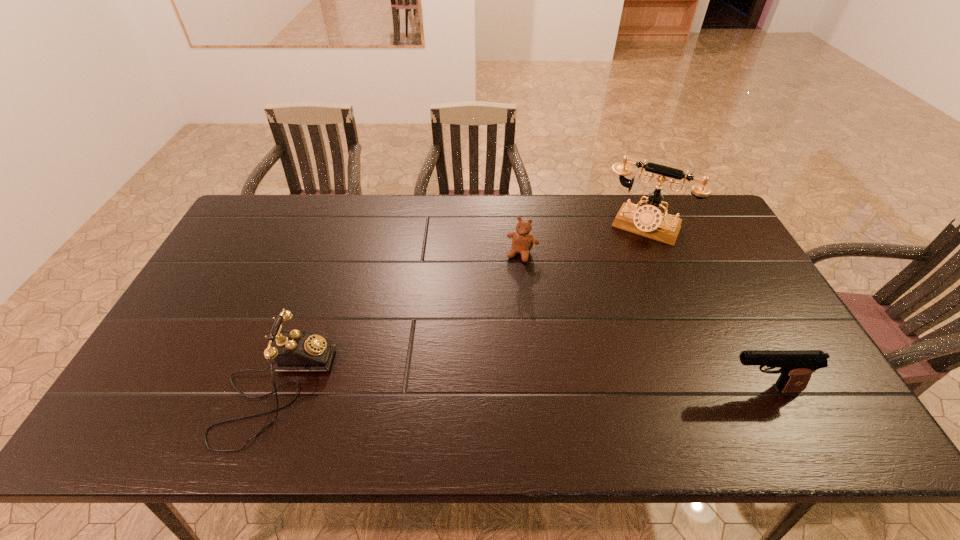
I want to click on unoccupied area between the taller telephone and the left telephone, so 460,308.

Where is `free space between the pistol and the leftmost object`? The height and width of the screenshot is (540, 960). free space between the pistol and the leftmost object is located at coordinates (518, 389).

The image size is (960, 540). Identify the location of free space between the teddy bear and the left telephone. (399, 322).

The height and width of the screenshot is (540, 960). In order to click on blank region between the pistol and the tallest object in this screenshot , I will do click(703, 308).

Find the location of `empty space that is in between the left telephone and the tallest object`. empty space that is in between the left telephone and the tallest object is located at coordinates (460, 308).

Where is `vacant area that lies between the taller telephone and the pistol`? vacant area that lies between the taller telephone and the pistol is located at coordinates click(x=703, y=308).

Where is `object that is the third closest one to the pistol`? The height and width of the screenshot is (540, 960). object that is the third closest one to the pistol is located at coordinates (293, 351).

Identify which object is located as the second nearest to the second object from left to right. Please provide its 2D coordinates. Your answer should be formatted as a tuple, i.e. [(x, y)], where the tuple contains the x and y coordinates of a point satisfying the conditions above.

[(293, 351)]

This screenshot has width=960, height=540. Identify the location of free space in the image that satisfies the following two spatial constraints: 1. on the front side of the pistol; 2. at the barrel of the teddy bear. (536, 389).